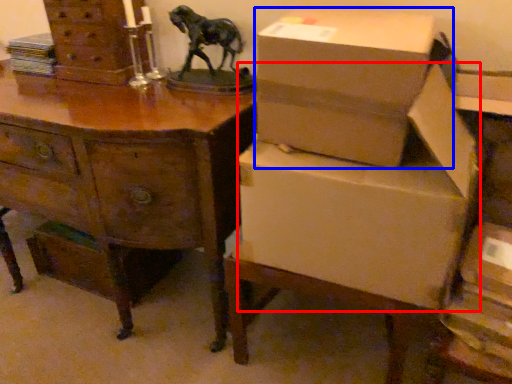
Question: Which object appears closest to the camera in this image, cardboard box (highlighted by a red box) or box (highlighted by a blue box)?

Choices:
 (A) cardboard box
 (B) box

Answer: (B)